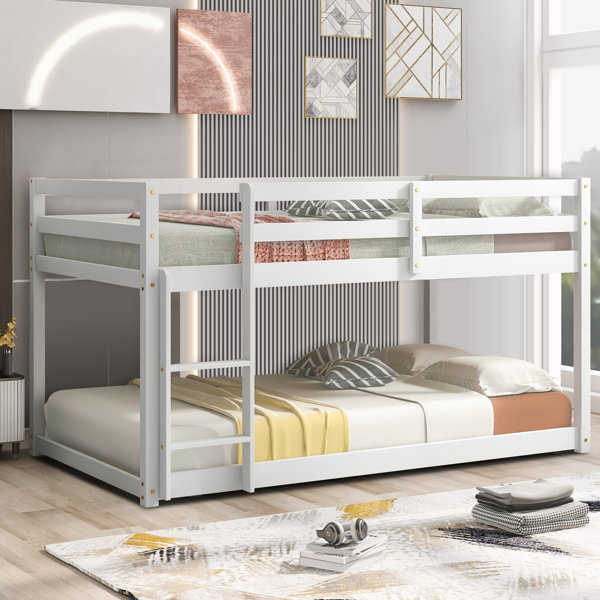
Image resolution: width=600 pixels, height=600 pixels. Find the location of `ladder`. ladder is located at coordinates (237, 360).